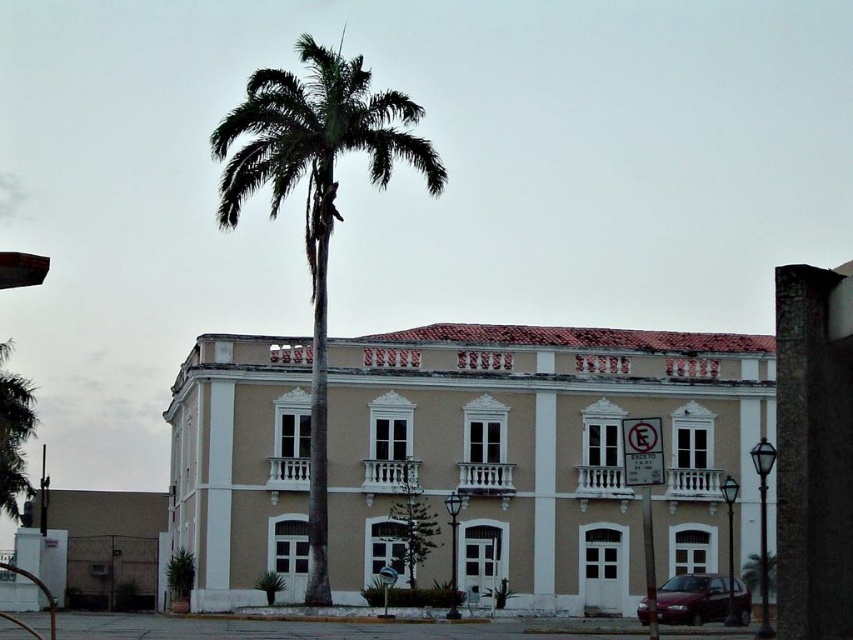
Question: Which point is closer to the camera?

Choices:
 (A) (223, 225)
 (B) (517, 452)

Answer: (A)

Question: Is beige stucco building at center positioned at the back of green leafy palm tree at center?

Choices:
 (A) no
 (B) yes

Answer: (B)

Question: Considering the relative positions of beige stucco building at center and green leafy palm tree at center in the image provided, where is beige stucco building at center located with respect to green leafy palm tree at center?

Choices:
 (A) left
 (B) right

Answer: (B)

Question: Is beige stucco building at center bigger than green leafy palm tree at center?

Choices:
 (A) no
 (B) yes

Answer: (A)